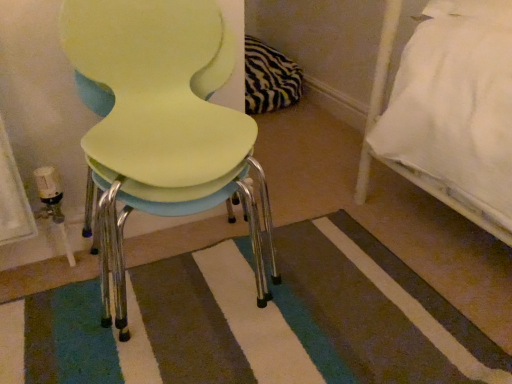
Question: Is matte yellow chair at center next to striped carpet at center?

Choices:
 (A) no
 (B) yes

Answer: (A)

Question: Can you confirm if matte yellow chair at center is thinner than striped carpet at center?

Choices:
 (A) no
 (B) yes

Answer: (B)

Question: From a real-world perspective, does matte yellow chair at center sit lower than striped carpet at center?

Choices:
 (A) yes
 (B) no

Answer: (B)

Question: Considering the relative sizes of matte yellow chair at center and striped carpet at center in the image provided, is matte yellow chair at center bigger than striped carpet at center?

Choices:
 (A) no
 (B) yes

Answer: (B)

Question: Can you confirm if matte yellow chair at center is taller than striped carpet at center?

Choices:
 (A) no
 (B) yes

Answer: (B)

Question: Does matte yellow chair at center come in front of striped carpet at center?

Choices:
 (A) yes
 (B) no

Answer: (A)

Question: From the image's perspective, does striped carpet at center appear lower than matte yellow chair at center?

Choices:
 (A) yes
 (B) no

Answer: (A)

Question: Is striped carpet at center looking in the opposite direction of matte yellow chair at center?

Choices:
 (A) yes
 (B) no

Answer: (B)

Question: Could you tell me if striped carpet at center is turned towards matte yellow chair at center?

Choices:
 (A) no
 (B) yes

Answer: (A)

Question: Can you confirm if striped carpet at center is wider than matte yellow chair at center?

Choices:
 (A) no
 (B) yes

Answer: (B)

Question: Is striped carpet at center smaller than matte yellow chair at center?

Choices:
 (A) no
 (B) yes

Answer: (B)

Question: Is matte yellow chair at center surrounded by striped carpet at center?

Choices:
 (A) yes
 (B) no

Answer: (B)

Question: From the image's perspective, is striped carpet at center located above or below matte yellow chair at center?

Choices:
 (A) below
 (B) above

Answer: (A)